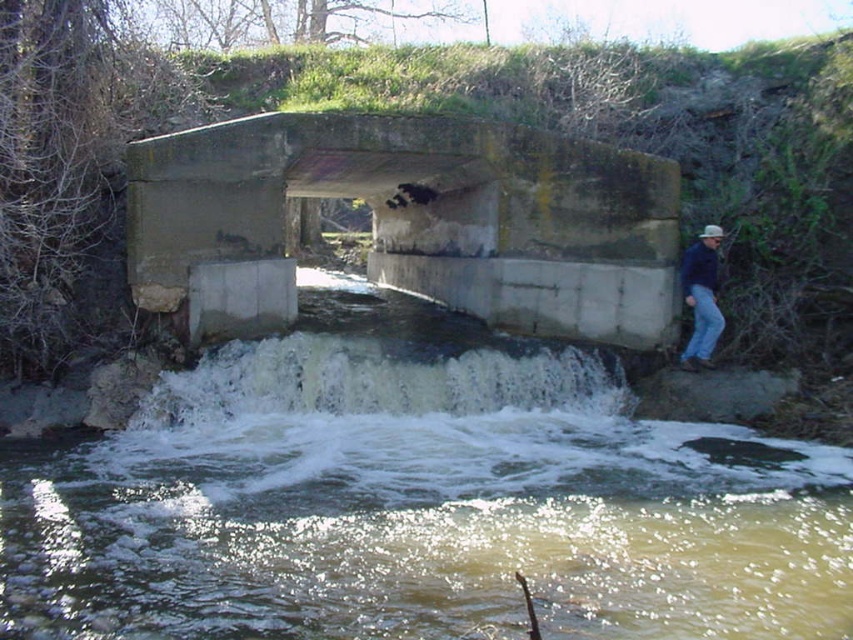
Does concrete bridge at center have a larger size compared to blue jeans at right?

Incorrect, concrete bridge at center is not larger than blue jeans at right.

Can you confirm if concrete bridge at center is positioned below blue jeans at right?

No.

Does point (230, 273) come behind point (718, 234)?

No, (230, 273) is closer to viewer.

The height and width of the screenshot is (640, 853). What are the coordinates of `concrete bridge at center` in the screenshot? It's located at (409, 221).

Is white frothy water at center positioned at the back of blue jeans at right?

That is False.

Is point (421, 346) behind point (701, 257)?

That is False.

This screenshot has height=640, width=853. What are the coordinates of `white frothy water at center` in the screenshot? It's located at (383, 378).

Who is positioned more to the left, brown concrete waterfall at center or concrete bridge at center?

Positioned to the left is brown concrete waterfall at center.

Where is `brown concrete waterfall at center`? This screenshot has height=640, width=853. brown concrete waterfall at center is located at coordinates (415, 499).